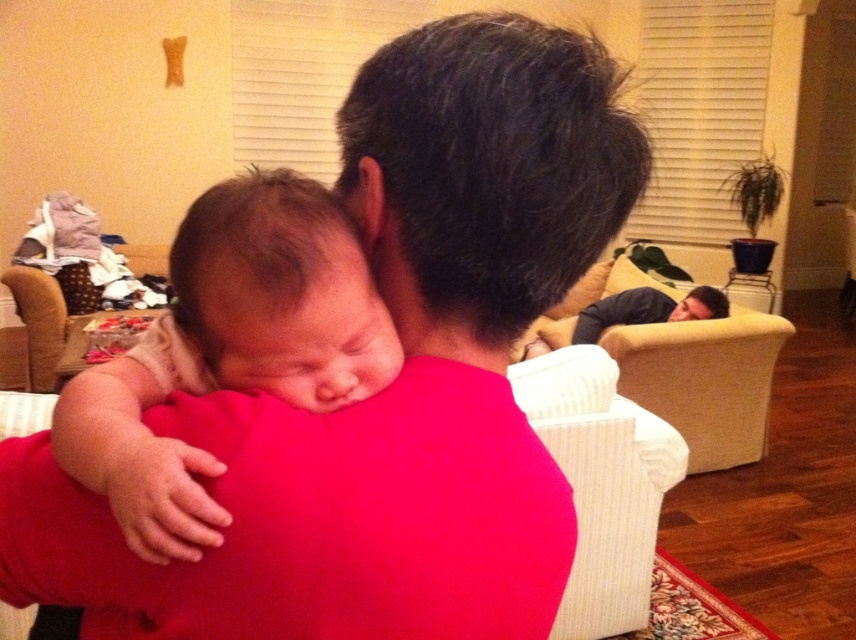
You are a photographer standing in the living room and want to take a closeup photo of the soft beige baby at center. The camera you are using has a minimum focusing distance of 50 centimeters. Can you take the photo without moving closer than 50 centimeters?

The soft beige baby at center is 47.98 centimeters from the viewer. Since the camera requires a minimum focusing distance of 50 centimeters, the photographer cannot take the closeup photo without moving closer than 50 centimeters because the baby is already within that distance.

You are a photographer trying to capture a closeup of the soft beige baby at center. The matte pink shirt at center is blocking your view. Is the baby above or below the shirt?

The soft beige baby at center is above the matte pink shirt at center because the description states the shirt is below the baby.